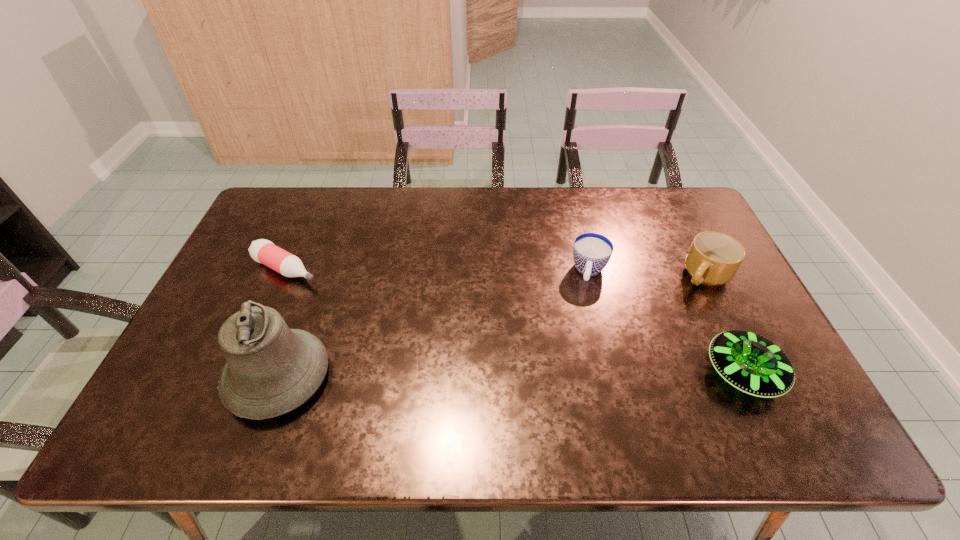
Locate an element on the screen. The image size is (960, 540). saucer located at the right edge is located at coordinates (751, 363).

Locate an element on the screen. The image size is (960, 540). mug present at the right edge is located at coordinates (713, 258).

You are a GUI agent. You are given a task and a screenshot of the screen. Output one action in this format:
    pyautogui.click(x=<x>, y=<y>)
    Task: Click on the object that is at the near left corner
    This screenshot has height=540, width=960.
    Given the screenshot: What is the action you would take?
    pyautogui.click(x=271, y=369)

This screenshot has height=540, width=960. What are the coordinates of `object positioned at the near right corner` in the screenshot? It's located at (751, 363).

Find the location of a particular element. vacant space at the far edge of the desktop is located at coordinates (390, 218).

Locate an element on the screen. vacant space at the left edge is located at coordinates coord(244,242).

You are a GUI agent. You are given a task and a screenshot of the screen. Output one action in this format:
    pyautogui.click(x=<x>, y=<y>)
    Task: Click on the free space at the right edge
    This screenshot has width=960, height=540.
    Given the screenshot: What is the action you would take?
    pyautogui.click(x=711, y=325)

In the image, there is a desktop. Where is `vacant space at the far left corner`? vacant space at the far left corner is located at coordinates (284, 190).

Identify the location of vacant space at the near left corner of the desktop. This screenshot has height=540, width=960. (214, 396).

Locate an element on the screen. The width and height of the screenshot is (960, 540). vacant region at the far right corner of the desktop is located at coordinates (668, 217).